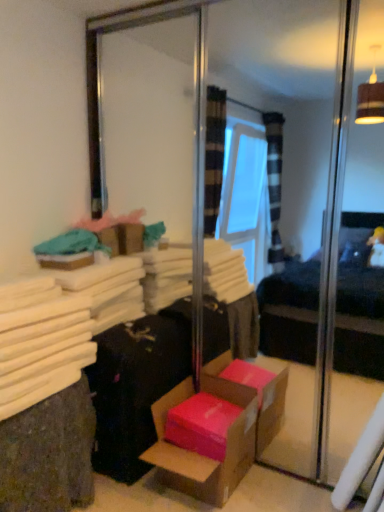
Question: From the image's perspective, does black fabric suitcase at lower left appear higher than white fabric at left?

Choices:
 (A) yes
 (B) no

Answer: (A)

Question: Is black fabric suitcase at lower left thinner than white fabric at left?

Choices:
 (A) yes
 (B) no

Answer: (A)

Question: Is black fabric suitcase at lower left in front of white fabric at left?

Choices:
 (A) no
 (B) yes

Answer: (A)

Question: Is black fabric suitcase at lower left at the left side of white fabric at left?

Choices:
 (A) yes
 (B) no

Answer: (B)

Question: From a real-world perspective, is black fabric suitcase at lower left beneath white fabric at left?

Choices:
 (A) yes
 (B) no

Answer: (B)

Question: Is black fabric suitcase at lower left behind white fabric at left?

Choices:
 (A) yes
 (B) no

Answer: (A)

Question: From the image's perspective, is white fabric at left on pink cardboard box at lower center?

Choices:
 (A) yes
 (B) no

Answer: (A)

Question: Is white fabric at left positioned before pink cardboard box at lower center?

Choices:
 (A) no
 (B) yes

Answer: (B)

Question: Does white fabric at left have a lesser width compared to pink cardboard box at lower center?

Choices:
 (A) no
 (B) yes

Answer: (A)

Question: Does white fabric at left appear on the right side of pink cardboard box at lower center?

Choices:
 (A) no
 (B) yes

Answer: (A)

Question: Does white fabric at left have a larger size compared to pink cardboard box at lower center?

Choices:
 (A) no
 (B) yes

Answer: (B)

Question: Does white fabric at left appear on the left side of pink cardboard box at lower center?

Choices:
 (A) no
 (B) yes

Answer: (B)

Question: From a real-world perspective, is black fabric suitcase at lower left located beneath pink cardboard box at lower center?

Choices:
 (A) yes
 (B) no

Answer: (B)